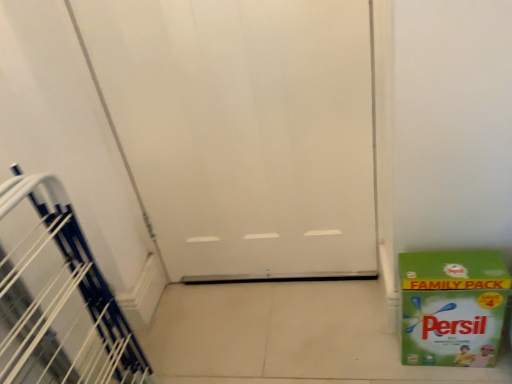
Question: Is white plastic stairwell at left at the right side of white matte door at center?

Choices:
 (A) yes
 (B) no

Answer: (B)

Question: Is white plastic stairwell at left with white matte door at center?

Choices:
 (A) no
 (B) yes

Answer: (A)

Question: Considering the relative sizes of white plastic stairwell at left and white matte door at center in the image provided, is white plastic stairwell at left bigger than white matte door at center?

Choices:
 (A) no
 (B) yes

Answer: (A)

Question: Considering the relative sizes of white plastic stairwell at left and white matte door at center in the image provided, is white plastic stairwell at left shorter than white matte door at center?

Choices:
 (A) no
 (B) yes

Answer: (B)

Question: Considering the relative sizes of white plastic stairwell at left and white matte door at center in the image provided, is white plastic stairwell at left wider than white matte door at center?

Choices:
 (A) yes
 (B) no

Answer: (A)

Question: From a real-world perspective, is green paper box at lower right above or below white plastic stairwell at left?

Choices:
 (A) below
 (B) above

Answer: (A)

Question: From the image's perspective, is green paper box at lower right above or below white plastic stairwell at left?

Choices:
 (A) above
 (B) below

Answer: (A)

Question: Relative to white plastic stairwell at left, is green paper box at lower right in front or behind?

Choices:
 (A) front
 (B) behind

Answer: (B)

Question: Considering the positions of green paper box at lower right and white plastic stairwell at left in the image, is green paper box at lower right wider or thinner than white plastic stairwell at left?

Choices:
 (A) thin
 (B) wide

Answer: (A)

Question: From a real-world perspective, is white plastic stairwell at left positioned above or below white matte door at center?

Choices:
 (A) below
 (B) above

Answer: (A)

Question: Is white plastic stairwell at left wider or thinner than white matte door at center?

Choices:
 (A) thin
 (B) wide

Answer: (B)

Question: Is white plastic stairwell at left to the left or to the right of white matte door at center in the image?

Choices:
 (A) left
 (B) right

Answer: (A)

Question: Considering their positions, is white plastic stairwell at left located in front of or behind white matte door at center?

Choices:
 (A) front
 (B) behind

Answer: (A)

Question: In the image, is green paper box at lower right positioned in front of or behind white matte door at center?

Choices:
 (A) behind
 (B) front

Answer: (A)

Question: From a real-world perspective, is green paper box at lower right positioned above or below white matte door at center?

Choices:
 (A) below
 (B) above

Answer: (A)